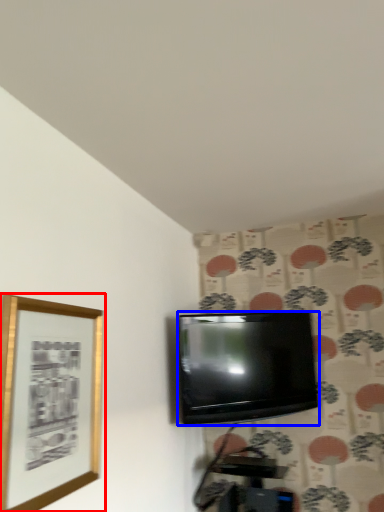
Question: Among these objects, which one is farthest to the camera, picture frame (highlighted by a red box) or television (highlighted by a blue box)?

Choices:
 (A) picture frame
 (B) television

Answer: (B)